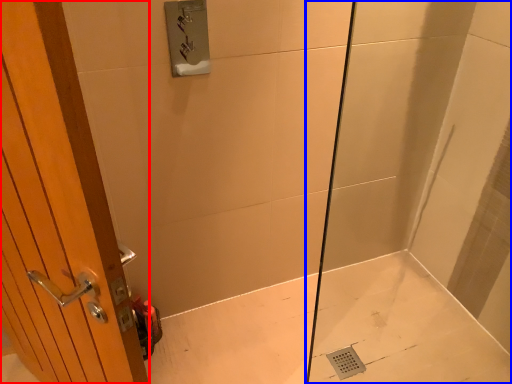
Question: Which object appears farthest to the camera in this image, door (highlighted by a red box) or shower door (highlighted by a blue box)?

Choices:
 (A) door
 (B) shower door

Answer: (B)